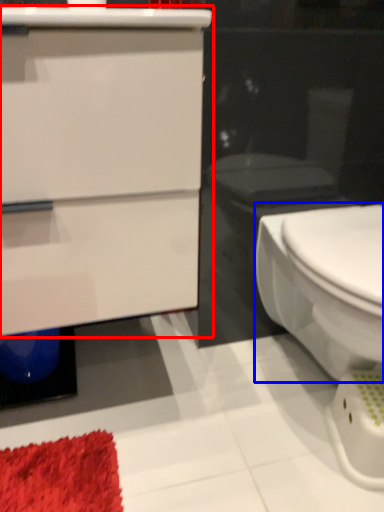
Question: Which point is closer to the camera, bathroom cabinet (highlighted by a red box) or bidet (highlighted by a blue box)?

Choices:
 (A) bathroom cabinet
 (B) bidet

Answer: (A)